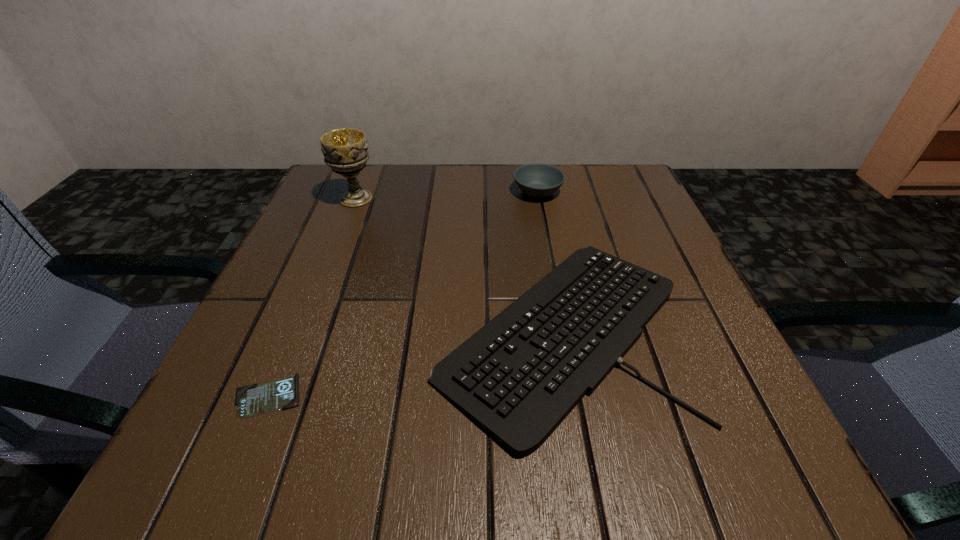
Image resolution: width=960 pixels, height=540 pixels. In the image, there is a desktop. Identify the location of blank space at the right edge. (656, 252).

I want to click on vacant space at the near left corner of the desktop, so click(307, 431).

This screenshot has height=540, width=960. What are the coordinates of `vacant space at the far right corner of the desktop` in the screenshot? It's located at (622, 193).

I want to click on vacant space at the near right corner, so click(692, 443).

This screenshot has height=540, width=960. Identify the location of empty location between the shortest object and the third tallest object. (415, 363).

Where is `vacant area between the soup bowl and the shortest object`? This screenshot has width=960, height=540. vacant area between the soup bowl and the shortest object is located at coordinates (403, 294).

Where is `empty space between the computer keyboard and the shortest object`? The image size is (960, 540). empty space between the computer keyboard and the shortest object is located at coordinates (415, 363).

The width and height of the screenshot is (960, 540). Identify the location of vacant area that lies between the second shortest object and the shortest object. (415, 363).

Where is `vacant area that lies between the tallest object and the identity card`? Image resolution: width=960 pixels, height=540 pixels. vacant area that lies between the tallest object and the identity card is located at coordinates coord(312,297).

Identify the location of vacant space that's between the third tallest object and the second tallest object. click(x=549, y=261).